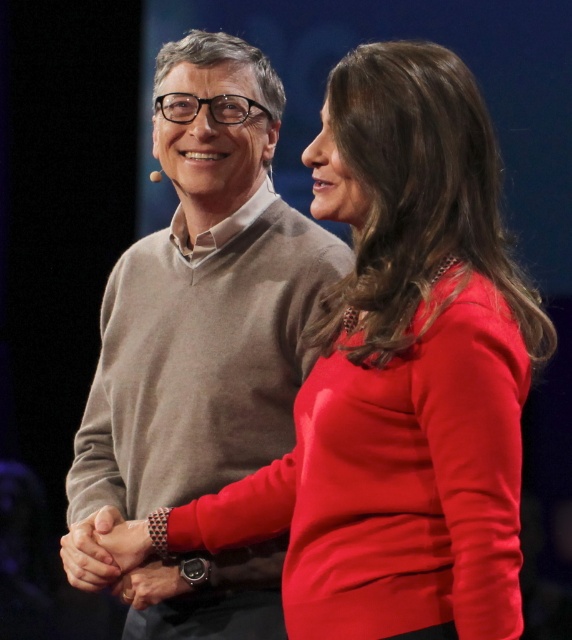
Between matte gray sweater at center and matte black hands at center, which one has more height?

With more height is matte gray sweater at center.

Describe the element at coordinates (204, 298) in the screenshot. The image size is (572, 640). I see `matte gray sweater at center` at that location.

Which is in front, point (213, 150) or point (101, 540)?

Point (101, 540) is in front.

You are a GUI agent. You are given a task and a screenshot of the screen. Output one action in this format:
    pyautogui.click(x=<x>, y=<y>)
    Task: Click on the matte gray sweater at center
    The image size is (572, 640).
    Given the screenshot: What is the action you would take?
    pyautogui.click(x=204, y=298)